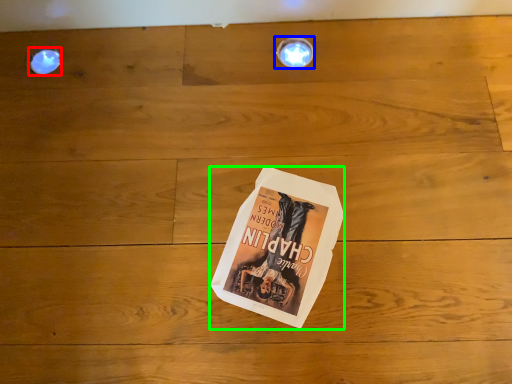
Question: Which object is the farthest from droplight (highlighted by a red box)? Choose among these: light fixture (highlighted by a blue box) or paperback book (highlighted by a green box).

Choices:
 (A) light fixture
 (B) paperback book

Answer: (B)